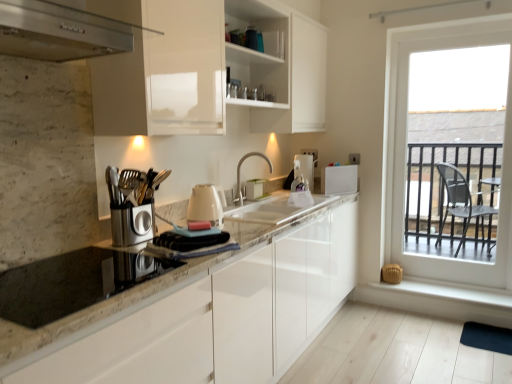
Locate an element on the screen. The width and height of the screenshot is (512, 384). vacant area that is in front of satin silver coffee machine at left is located at coordinates (100, 264).